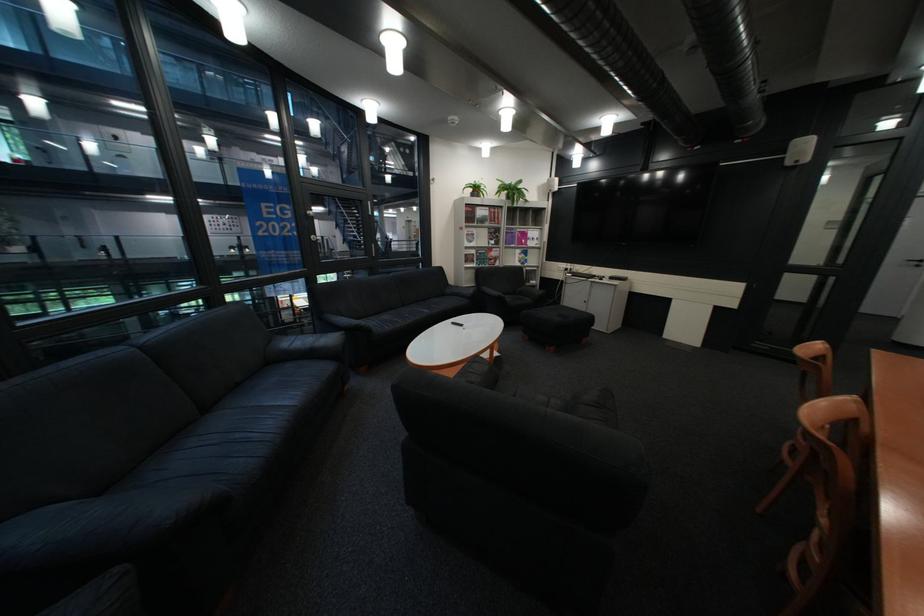
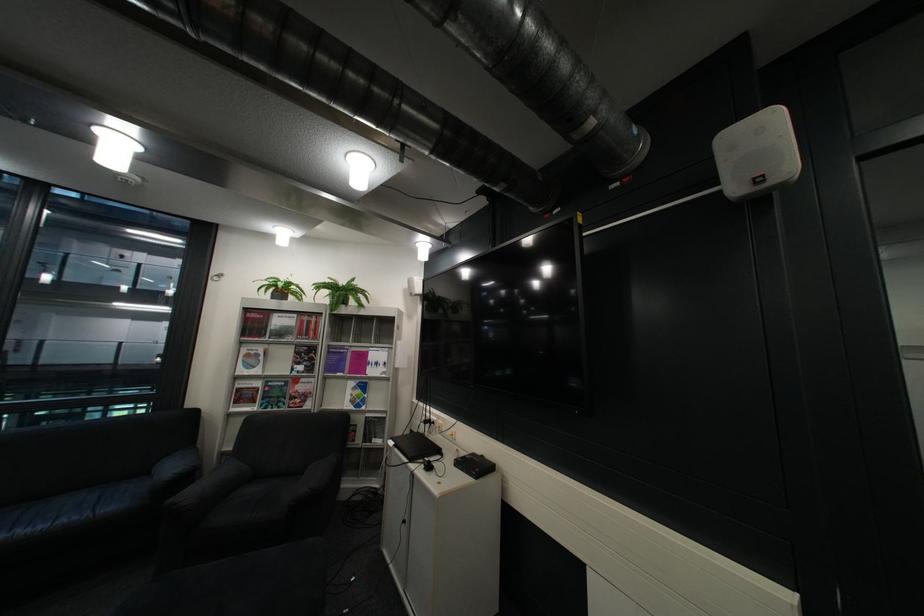
The point at (481, 254) is marked in the first image. Where is the corresponding point in the second image?

(254, 390)